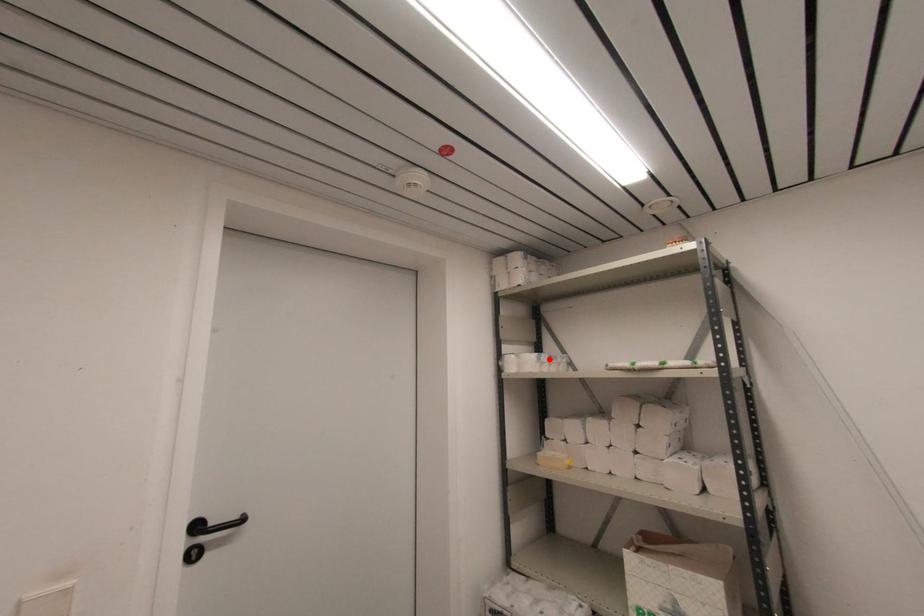
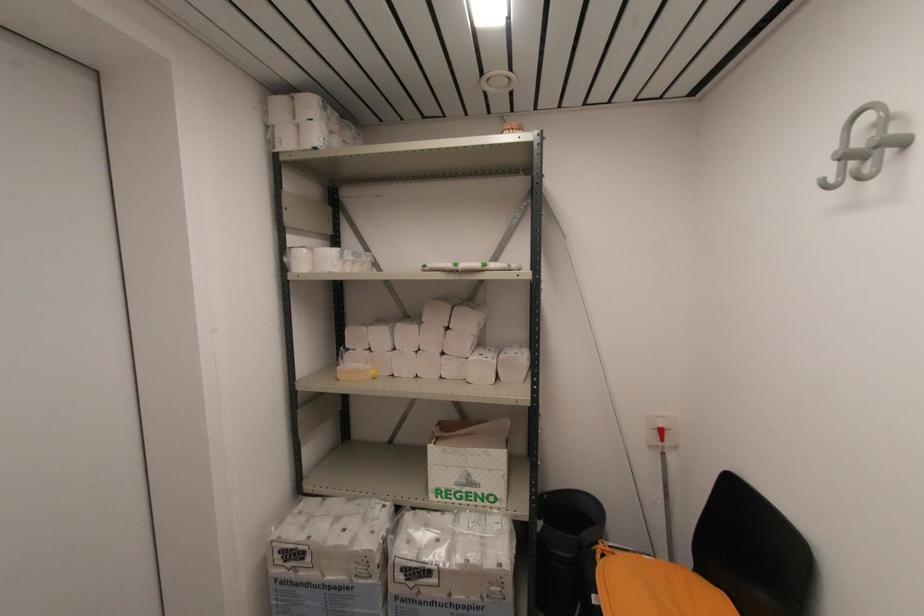
Find the pixel in the second image that matches the highlighted location in the first image.

(353, 257)